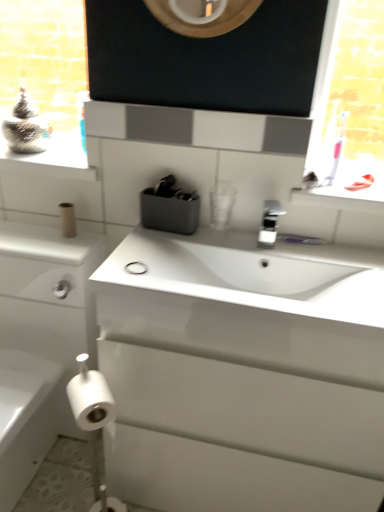
This screenshot has width=384, height=512. Identify the location of vacant area to the left of silver metallic faucet at center. (216, 246).